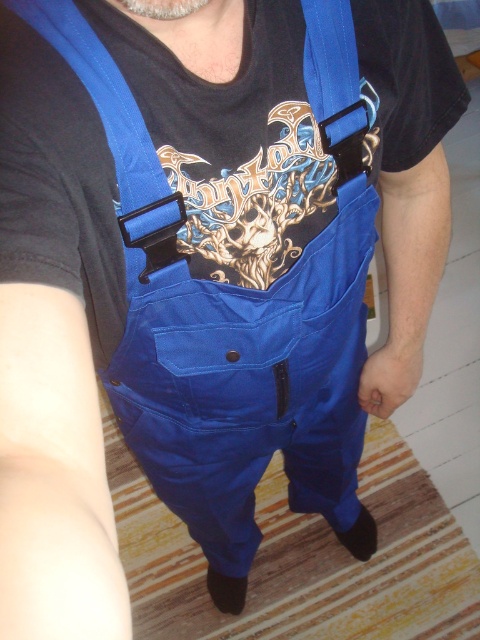
Based on the photo, you are trying to adjust your suspenders and straps while looking at the blue fabric suspenders at upper center and the matte blue straps at upper center. Which one do you need to reach forward to adjust?

The blue fabric suspenders at upper center are closer to the viewer than the matte blue straps at upper center, so you would need to reach forward to adjust the matte blue straps at upper center which are further away.

Looking at this image, you are a fashion designer analyzing the image of a person wearing blue overalls with black straps and buckles. You notice a point at coordinates [131,157]. Based on the image description, can you determine which part of the outfit this point corresponds to?

The point at [131,157] is on the blue fabric suspenders at upper center.

You are trying to adjust your suspenders and straps while looking at the blue fabric suspenders at upper center and the matte blue straps at upper center. Which one should you grab if you want to adjust the one on the right side?

The matte blue straps at upper center is on the right, so grab that one to adjust the one on the right side.